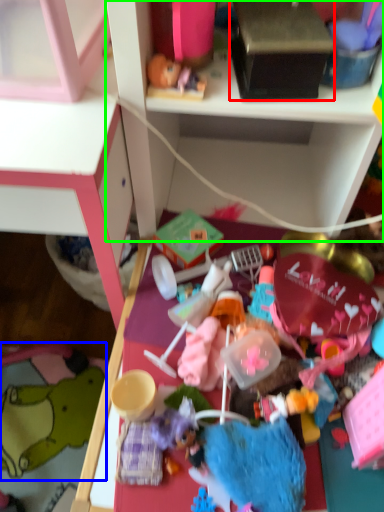
Question: Which is nearer to the box (highlighted by a red box)? toy (highlighted by a blue box) or shelf (highlighted by a green box).

Choices:
 (A) toy
 (B) shelf

Answer: (B)